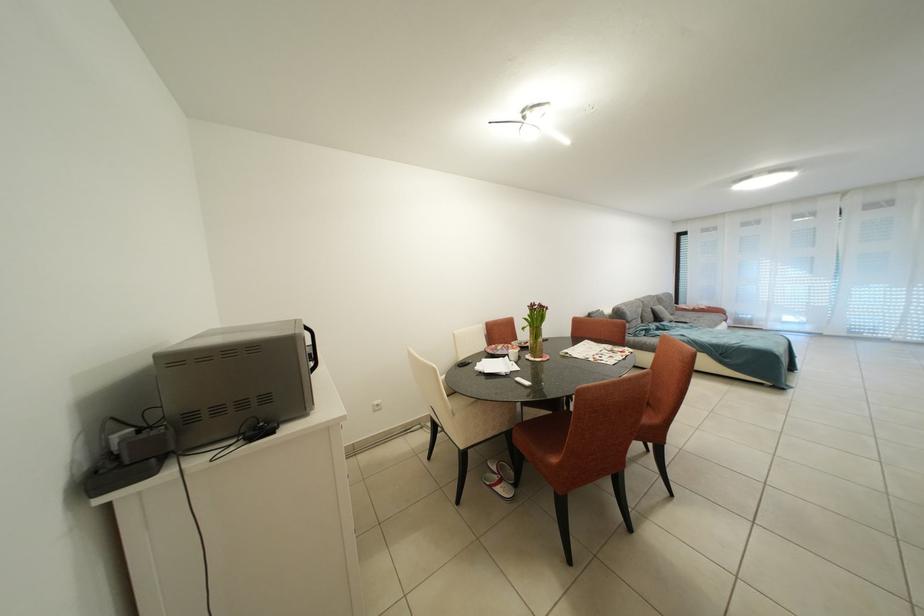
What do you see at coordinates (312, 346) in the screenshot? I see `the microwave handle` at bounding box center [312, 346].